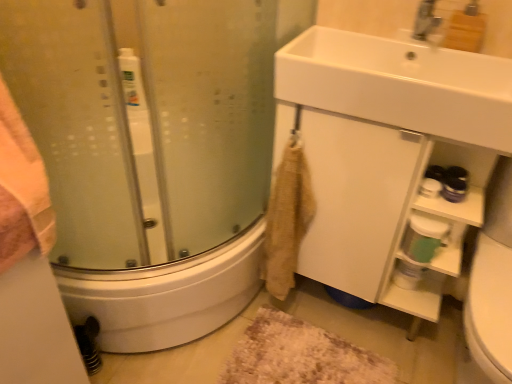
Question: From a real-world perspective, relative to brown shaggy bath mat at lower center, is beige textured towel at lower center vertically above or below?

Choices:
 (A) above
 (B) below

Answer: (A)

Question: In terms of width, does beige textured towel at lower center look wider or thinner when compared to brown shaggy bath mat at lower center?

Choices:
 (A) thin
 (B) wide

Answer: (A)

Question: Which of these objects is positioned farthest from the white glossy sink at upper right?

Choices:
 (A) white matte cabinet at lower right
 (B) brown shaggy bath mat at lower center
 (C) beige textured towel at lower center
 (D) green plastic container at lower right
 (E) transparent glass shower door at left

Answer: (B)

Question: Estimate the real-world distances between objects in this image. Which object is farther from the green plastic container at lower right?

Choices:
 (A) white glossy sink at upper right
 (B) brown shaggy bath mat at lower center
 (C) transparent glass shower door at left
 (D) white matte cabinet at lower right
 (E) beige textured towel at lower center

Answer: (C)